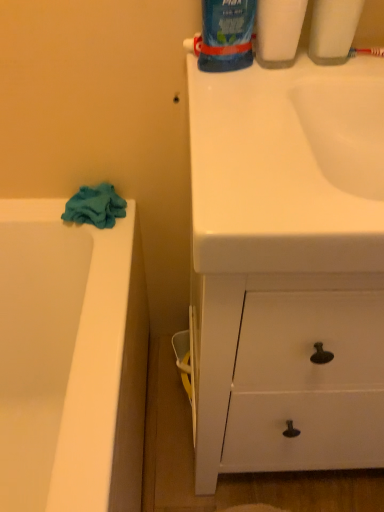
Question: Is blue glossy toothpaste tube at upper right, which is counted as the 1th cleaning product, starting from the right, thinner than red plastic toothbrush at upper right?

Choices:
 (A) no
 (B) yes

Answer: (A)

Question: Is blue glossy toothpaste tube at upper right, which is counted as the 1th cleaning product, starting from the right, looking in the opposite direction of red plastic toothbrush at upper right?

Choices:
 (A) no
 (B) yes

Answer: (A)

Question: Is red plastic toothbrush at upper right completely or partially inside blue glossy toothpaste tube at upper right, which appears as the third cleaning product when viewed from the left?

Choices:
 (A) no
 (B) yes

Answer: (A)

Question: Can you confirm if blue glossy toothpaste tube at upper right, which appears as the third cleaning product when viewed from the left, is shorter than red plastic toothbrush at upper right?

Choices:
 (A) yes
 (B) no

Answer: (B)

Question: Does blue glossy toothpaste tube at upper right, which appears as the third cleaning product when viewed from the left, have a greater height compared to red plastic toothbrush at upper right?

Choices:
 (A) yes
 (B) no

Answer: (A)

Question: Considering the positions of point (107, 221) and point (261, 7), is point (107, 221) closer or farther from the camera than point (261, 7)?

Choices:
 (A) closer
 (B) farther

Answer: (B)

Question: Choose the correct answer: Is teal fabric towel at left inside blue glossy bottle at upper center, placed as the second cleaning product when sorted from right to left, or outside it?

Choices:
 (A) inside
 (B) outside

Answer: (B)

Question: In the image, is teal fabric towel at left on the left side or the right side of blue glossy bottle at upper center, placed as the second cleaning product when sorted from right to left?

Choices:
 (A) right
 (B) left

Answer: (B)

Question: From the image's perspective, is teal fabric towel at left above or below blue glossy bottle at upper center, the second cleaning product from the left?

Choices:
 (A) below
 (B) above

Answer: (A)

Question: From the image's perspective, is blue glossy toothpaste tube at upper right, which is counted as the 1th cleaning product, starting from the right, above or below blue glossy bottle at upper center, the second cleaning product from the left?

Choices:
 (A) above
 (B) below

Answer: (A)

Question: Relative to blue glossy bottle at upper center, placed as the second cleaning product when sorted from right to left, is blue glossy toothpaste tube at upper right, which appears as the third cleaning product when viewed from the left, in front or behind?

Choices:
 (A) front
 (B) behind

Answer: (A)

Question: Does point (352, 17) appear closer or farther from the camera than point (269, 11)?

Choices:
 (A) closer
 (B) farther

Answer: (B)

Question: Considering the positions of blue glossy toothpaste tube at upper right, which is counted as the 1th cleaning product, starting from the right, and blue glossy bottle at upper center, placed as the second cleaning product when sorted from right to left, in the image, is blue glossy toothpaste tube at upper right, which is counted as the 1th cleaning product, starting from the right, taller or shorter than blue glossy bottle at upper center, placed as the second cleaning product when sorted from right to left,?

Choices:
 (A) short
 (B) tall

Answer: (B)

Question: Is blue glossy toothpaste at upper center, the 3th cleaning product from the right, spatially inside blue glossy toothpaste tube at upper right, which appears as the third cleaning product when viewed from the left, or outside of it?

Choices:
 (A) inside
 (B) outside

Answer: (B)

Question: From a real-world perspective, is blue glossy toothpaste at upper center, which is the 1th cleaning product from left to right, above or below blue glossy toothpaste tube at upper right, which appears as the third cleaning product when viewed from the left?

Choices:
 (A) below
 (B) above

Answer: (B)